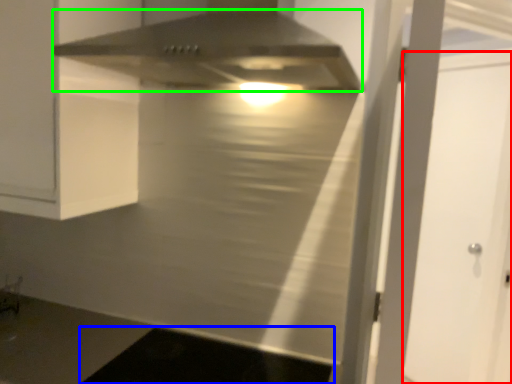
Question: Based on their relative distances, which object is nearer to glass door (highlighted by a red box)? Choose from dark (highlighted by a blue box) and home appliance (highlighted by a green box).

Choices:
 (A) dark
 (B) home appliance

Answer: (A)